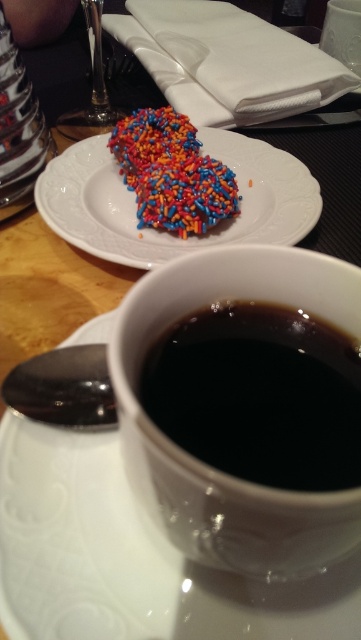
Question: Is white ceramic saucer at upper center smaller than sprinkled cookie at upper left?

Choices:
 (A) yes
 (B) no

Answer: (A)

Question: Among these points, which one is nearest to the camera?

Choices:
 (A) (193, 372)
 (B) (154, 122)
 (C) (171, 228)

Answer: (A)

Question: Can you confirm if black glossy cup at center is positioned to the left of candy-coated donut at upper left?

Choices:
 (A) no
 (B) yes

Answer: (A)

Question: Which object appears farthest from the camera in this image?

Choices:
 (A) candy-coated donut at upper left
 (B) candy-coated donut at center

Answer: (B)

Question: Which point is farther to the camera?

Choices:
 (A) (123, 125)
 (B) (46, 182)
 (C) (154, 145)
 (D) (27, 518)

Answer: (A)

Question: Is black glossy cup at center closer to the viewer compared to candy-coated donut at center?

Choices:
 (A) no
 (B) yes

Answer: (B)